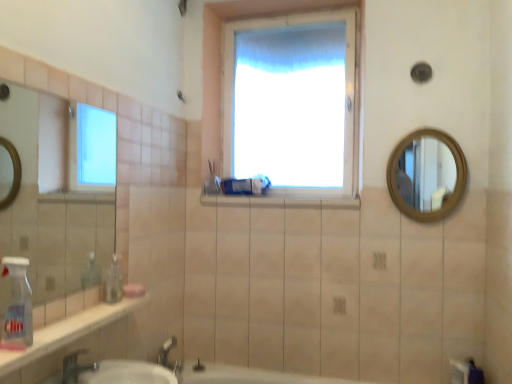
Identify the location of white plastic bottle at lower left. (18, 306).

Image resolution: width=512 pixels, height=384 pixels. What do you see at coordinates (133, 290) in the screenshot?
I see `pink matte soap at lower left` at bounding box center [133, 290].

In order to face wooden round mirror at upper right, should I rotate leftwards or rightwards?

To face it directly, rotate right by 21.703 degrees.

In order to click on wooden round mirror at upper right in this screenshot , I will do `click(426, 173)`.

Locate an element on the screen. The height and width of the screenshot is (384, 512). silver metallic faucet at lower left is located at coordinates (76, 367).

The width and height of the screenshot is (512, 384). Identify the location of white glossy window sill at center. (281, 200).

Locate an element on the screen. This screenshot has height=384, width=512. white plastic bottle at lower left is located at coordinates (18, 306).

Does silver metallic faucet at lower left come behind white plastic bottle at lower left?

Yes, it is behind white plastic bottle at lower left.

Who is shorter, silver metallic faucet at lower left or white plastic bottle at lower left?

silver metallic faucet at lower left is shorter.

Based on the photo, does silver metallic faucet at lower left have a greater width compared to white plastic bottle at lower left?

Indeed, silver metallic faucet at lower left has a greater width compared to white plastic bottle at lower left.

Considering the relative sizes of wooden round mirror at upper right and pink matte soap at lower left in the image provided, is wooden round mirror at upper right bigger than pink matte soap at lower left?

Correct, wooden round mirror at upper right is larger in size than pink matte soap at lower left.

From the image's perspective, who appears lower, wooden round mirror at upper right or pink matte soap at lower left?

From the image's view, pink matte soap at lower left is below.

Which point is more forward, (429, 147) or (134, 294)?

Point (134, 294)

At what (x,y) coordinates should I click in order to perform the action: click on soap below the wooden round mirror at upper right (from the image's perspective). Please return your answer as a coordinate pair (x, y). Looking at the image, I should click on (133, 290).

Is white glossy window sill at center looking in the opposite direction of wooden round mirror at upper right?

No, white glossy window sill at center's orientation is not away from wooden round mirror at upper right.

From the image's perspective, which one is positioned higher, white glossy window sill at center or wooden round mirror at upper right?

wooden round mirror at upper right appears higher in the image.

Considering the sizes of white glossy window sill at center and wooden round mirror at upper right in the image, is white glossy window sill at center wider or thinner than wooden round mirror at upper right?

In the image, white glossy window sill at center appears to be wider than wooden round mirror at upper right.

At what (x,y) coordinates should I click in order to perform the action: click on window sill on the left of the wooden round mirror at upper right. Please return your answer as a coordinate pair (x, y). Looking at the image, I should click on (281, 200).

Is pink matte soap at lower left not inside matte plastic toothbrush at center?

Yes, pink matte soap at lower left is outside of matte plastic toothbrush at center.

Consider the image. Who is shorter, pink matte soap at lower left or matte plastic toothbrush at center?

Standing shorter between the two is pink matte soap at lower left.

From the picture: From a real-world perspective, between pink matte soap at lower left and matte plastic toothbrush at center, who is vertically higher?

From a 3D spatial view, matte plastic toothbrush at center is above.

This screenshot has width=512, height=384. Identify the location of toiletry above the pink matte soap at lower left (from the image's perspective). (212, 181).

Based on the photo, is silver metallic faucet at lower left turned away from wooden round mirror at upper right?

No, silver metallic faucet at lower left's orientation is not away from wooden round mirror at upper right.

Is the position of silver metallic faucet at lower left less distant than that of wooden round mirror at upper right?

Yes, it is.

Find the location of a particular element. Image resolution: width=512 pixels, height=384 pixels. tap lying in front of the wooden round mirror at upper right is located at coordinates (76, 367).

From a real-world perspective, which object stands above the other?

wooden round mirror at upper right, from a real-world perspective.

Which of these two, white glossy window sill at center or matte plastic toothbrush at center, stands taller?

Standing taller between the two is matte plastic toothbrush at center.

Does white glossy window sill at center have a greater width compared to matte plastic toothbrush at center?

Yes.

Is white glossy window sill at center not close to matte plastic toothbrush at center?

That's not correct — white glossy window sill at center is a little close to matte plastic toothbrush at center.

How many degrees apart are the facing directions of white glossy window sill at center and matte plastic toothbrush at center?

90.4 degrees separate the facing orientations of white glossy window sill at center and matte plastic toothbrush at center.

In the scene shown: From the image's perspective, is wooden round mirror at upper right positioned above or below white plastic bottle at lower left?

Based on their image positions, wooden round mirror at upper right is located above white plastic bottle at lower left.

Between wooden round mirror at upper right and white plastic bottle at lower left, which one has larger width?

With larger width is white plastic bottle at lower left.

Is point (443, 178) positioned behind point (19, 285)?

Yes, point (443, 178) is farther from viewer.

At what (x,y) coordinates should I click in order to perform the action: click on tap located behind the white plastic bottle at lower left. Please return your answer as a coordinate pair (x, y). The width and height of the screenshot is (512, 384). Looking at the image, I should click on [x=76, y=367].

At what (x,y) coordinates should I click in order to perform the action: click on mirror to the right of pink matte soap at lower left. Please return your answer as a coordinate pair (x, y). Image resolution: width=512 pixels, height=384 pixels. Looking at the image, I should click on (426, 173).

Estimate the real-world distances between objects in this image. Which object is further from white plastic bottle at lower left, silver metallic faucet at lower left or white glossy window sill at center?

white glossy window sill at center is further to white plastic bottle at lower left.

Based on their spatial positions, is matte plastic toothbrush at center or wooden round mirror at upper right closer to silver metallic faucet at lower left?

matte plastic toothbrush at center lies closer to silver metallic faucet at lower left than the other object.

When comparing their distances from pink matte soap at lower left, does white glossy window sill at center or white plastic bottle at lower left seem further?

white glossy window sill at center lies further to pink matte soap at lower left than the other object.

When comparing their distances from white plastic bottle at lower left, does wooden round mirror at upper right or silver metallic faucet at lower left seem further?

wooden round mirror at upper right lies further to white plastic bottle at lower left than the other object.

Based on their spatial positions, is pink matte soap at lower left or wooden round mirror at upper right closer to matte plastic toothbrush at center?

pink matte soap at lower left.

Considering their positions, is white plastic bottle at lower left positioned further to wooden round mirror at upper right than white glossy window sill at center?

white plastic bottle at lower left is positioned further to the anchor wooden round mirror at upper right.

Estimate the real-world distances between objects in this image. Which object is further from pink matte soap at lower left, white glossy window sill at center or wooden round mirror at upper right?

Based on the image, wooden round mirror at upper right appears to be further to pink matte soap at lower left.

Looking at the image, which one is located closer to silver metallic faucet at lower left, pink matte soap at lower left or matte plastic toothbrush at center?

pink matte soap at lower left.

Find the location of a particular element. This screenshot has width=512, height=384. tap between white plastic bottle at lower left and wooden round mirror at upper right from left to right is located at coordinates (76, 367).

Locate an element on the screen. window sill located between pink matte soap at lower left and wooden round mirror at upper right in the left-right direction is located at coordinates (x=281, y=200).

Locate an element on the screen. window sill positioned between silver metallic faucet at lower left and matte plastic toothbrush at center from near to far is located at coordinates (281, 200).

Where is `window sill situated between silver metallic faucet at lower left and wooden round mirror at upper right from left to right`? window sill situated between silver metallic faucet at lower left and wooden round mirror at upper right from left to right is located at coordinates (281, 200).